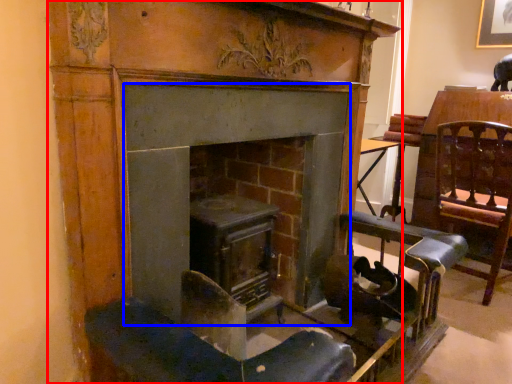
Question: Among these objects, which one is nearest to the camera, fireplace (highlighted by a red box) or fireplace (highlighted by a blue box)?

Choices:
 (A) fireplace
 (B) fireplace

Answer: (A)